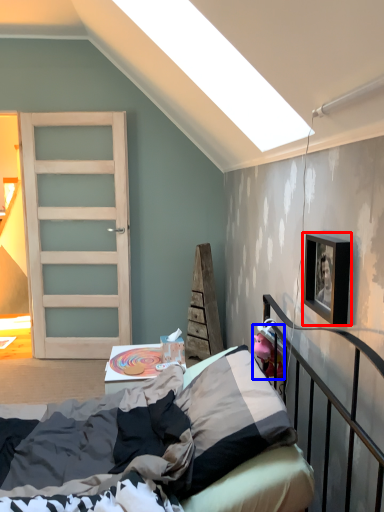
Question: Which object is closer to the camera taking this photo, picture frame (highlighted by a red box) or toy (highlighted by a blue box)?

Choices:
 (A) picture frame
 (B) toy

Answer: (A)